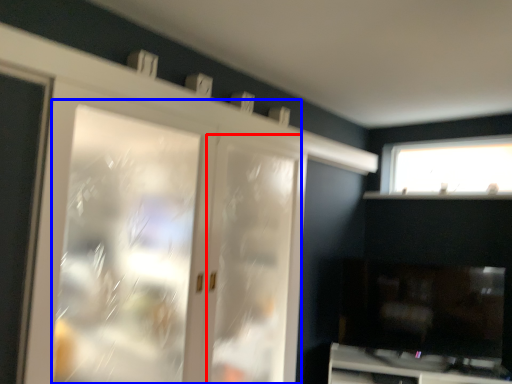
Question: Which point is closer to the camera, screen door (highlighted by a red box) or screen door (highlighted by a blue box)?

Choices:
 (A) screen door
 (B) screen door

Answer: (B)